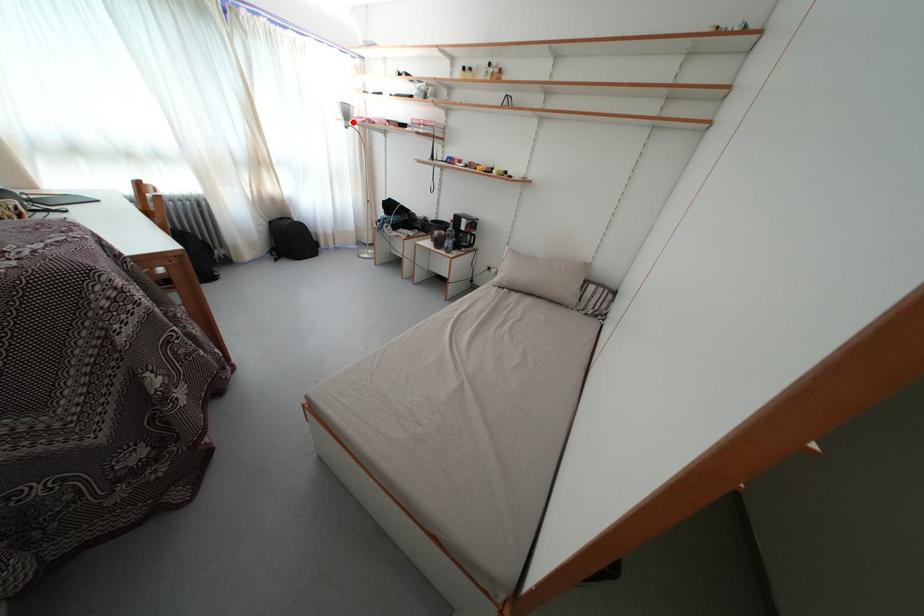
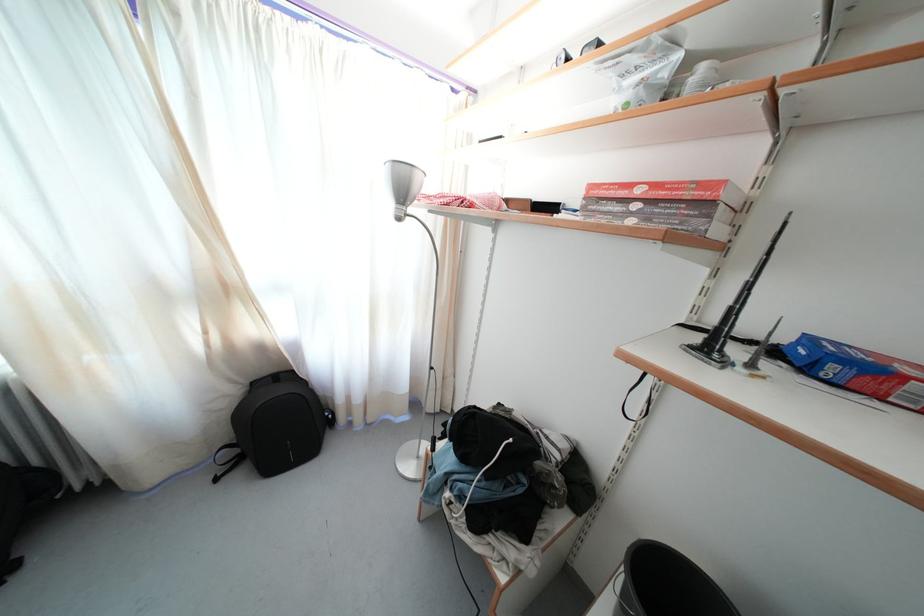
Locate, in the second image, the point that corresponds to the highlighted location in the first image.

(408, 199)